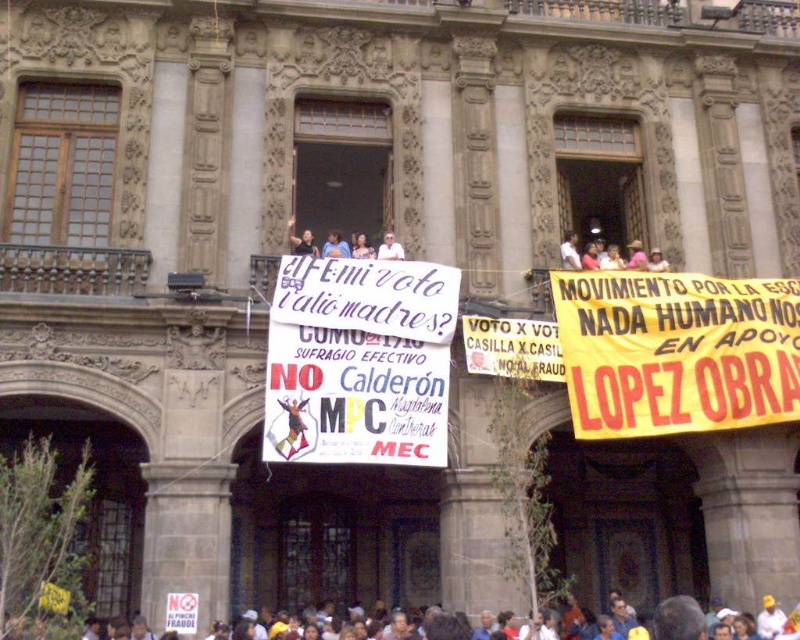
The height and width of the screenshot is (640, 800). What do you see at coordinates (676, 352) in the screenshot? I see `yellow fabric banner at upper right` at bounding box center [676, 352].

Who is more distant from viewer, (629,285) or (352,326)?

The point (629,285) is more distant.

The image size is (800, 640). Describe the element at coordinates (676, 352) in the screenshot. I see `yellow fabric banner at upper right` at that location.

The width and height of the screenshot is (800, 640). I want to click on yellow fabric banner at upper right, so click(676, 352).

Is point (664, 612) more distant than point (378, 253)?

No, (664, 612) is in front of (378, 253).

Looking at this image, does multicolored fabric crowd at lower center have a greater width compared to light skin tone shirt at center?

Yes.

Is point (240, 630) positioned in front of point (393, 248)?

Yes.

What are the coordinates of `multicolored fabric crowd at lower center` in the screenshot? It's located at (680, 620).

Can you confirm if multicolored fabric crowd at lower center is shorter than white fabric at upper center?

No, multicolored fabric crowd at lower center is not shorter than white fabric at upper center.

Does multicolored fabric crowd at lower center come in front of white fabric at upper center?

That is True.

Who is more distant from viewer, (682,628) or (576,264)?

The point (576,264) is behind.

Where is `multicolored fabric crowd at lower center`? multicolored fabric crowd at lower center is located at coordinates click(x=680, y=620).